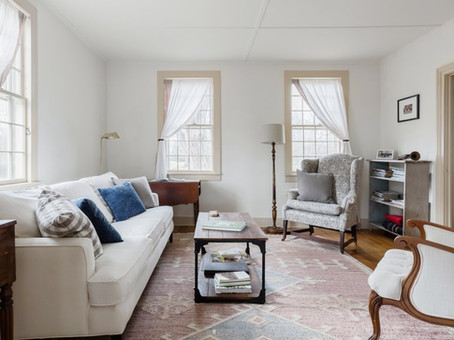
Image resolution: width=454 pixels, height=340 pixels. I want to click on ceiling, so click(x=230, y=6).